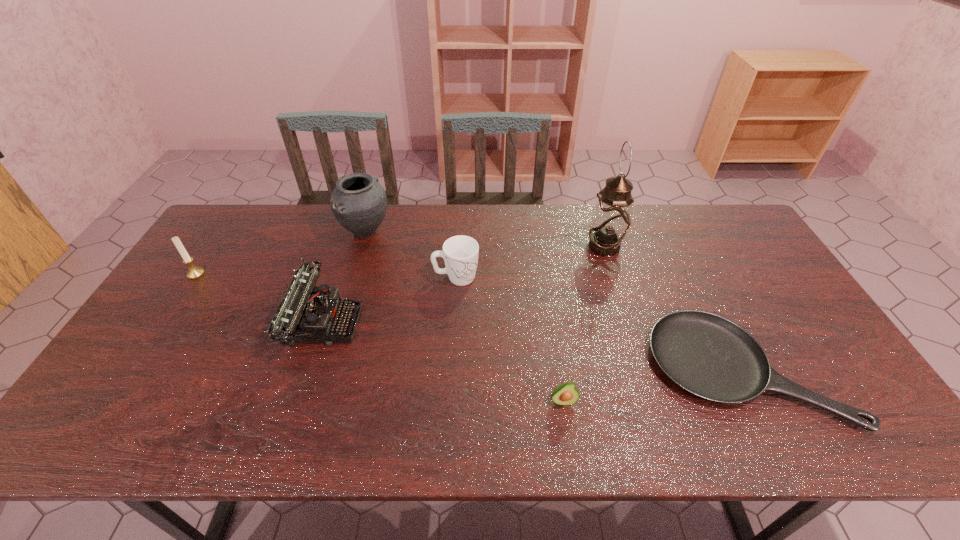
Locate an element on the screen. object at the near right corner is located at coordinates (707, 355).

Image resolution: width=960 pixels, height=540 pixels. In the image, there is a desktop. Identify the location of vacant region at the far edge. (346, 241).

Find the location of a particular element. This screenshot has height=540, width=960. vacant point at the near edge is located at coordinates (505, 424).

Identify the location of vacant point at the left edge. This screenshot has width=960, height=540. (175, 379).

Where is `vacant point at the right edge`? This screenshot has height=540, width=960. vacant point at the right edge is located at coordinates (805, 336).

Identify the location of vacant space at the far left corner. This screenshot has height=540, width=960. (253, 220).

Find the location of a particular element. vacant space at the near left corner of the desktop is located at coordinates (133, 418).

Identify the location of free space between the fourth object from left to right and the frying pan. This screenshot has width=960, height=540. (600, 323).

Locate an element on the screen. This screenshot has height=540, width=960. free point between the urn and the oil lamp is located at coordinates (485, 239).

Image resolution: width=960 pixels, height=540 pixels. What are the coordinates of `empty space that is in between the urn and the fourth object from right to left` in the screenshot? It's located at (411, 255).